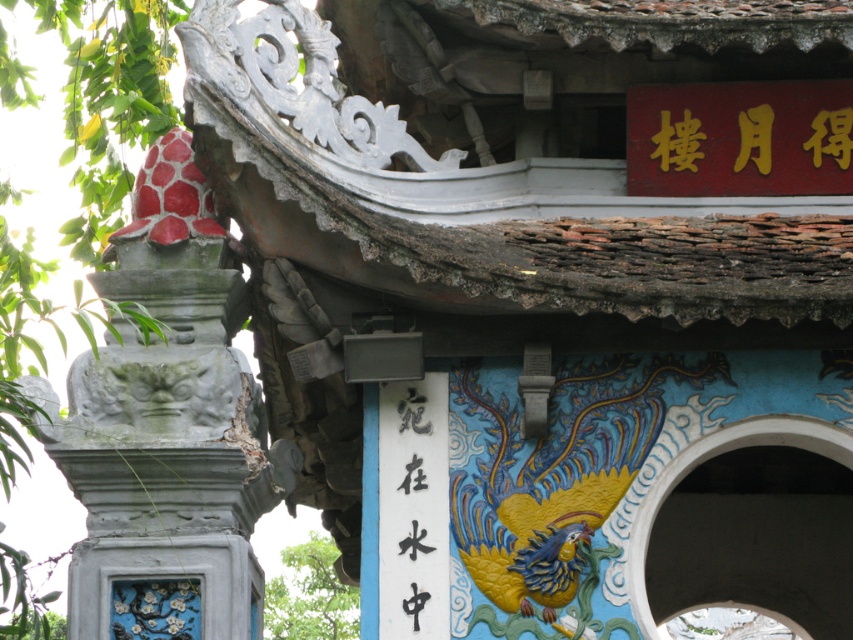
Between blue painted stone arch at center and black paper at center, which one appears on the left side from the viewer's perspective?

black paper at center

Which is behind, point (799, 444) or point (421, 593)?

The point (799, 444) is behind.

Find the location of a particular element. The width and height of the screenshot is (853, 640). blue painted stone arch at center is located at coordinates (706, 458).

Is smooth gray stone pillar at left wider than black paper at center?

Indeed, smooth gray stone pillar at left has a greater width compared to black paper at center.

Who is higher up, smooth gray stone pillar at left or black paper at center?

smooth gray stone pillar at left is higher up.

Does point (154, 192) lie behind point (409, 472)?

That is True.

Where is `smooth gray stone pillar at left`? Image resolution: width=853 pixels, height=640 pixels. smooth gray stone pillar at left is located at coordinates (167, 428).

Can you confirm if smooth gray stone pillar at left is positioned to the left of blue painted stone arch at center?

Yes, smooth gray stone pillar at left is to the left of blue painted stone arch at center.

Does smooth gray stone pillar at left come in front of blue painted stone arch at center?

Yes, it is.

What do you see at coordinates (167, 428) in the screenshot? The image size is (853, 640). I see `smooth gray stone pillar at left` at bounding box center [167, 428].

Image resolution: width=853 pixels, height=640 pixels. What are the coordinates of `smooth gray stone pillar at left` in the screenshot? It's located at (167, 428).